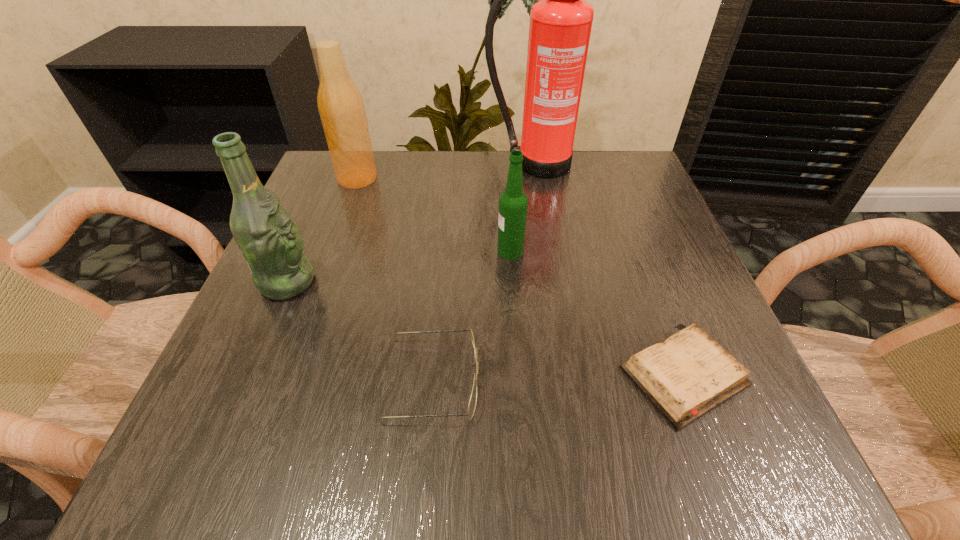
This screenshot has height=540, width=960. What are the coordinates of `vacant area situated on the surface of the nearest beer bottle` in the screenshot? It's located at (398, 282).

The height and width of the screenshot is (540, 960). I want to click on free location located 0.100m on the label of the rightmost beer bottle, so click(x=445, y=251).

Where is `free region located 0.080m on the label of the rightmost beer bottle`? The image size is (960, 540). free region located 0.080m on the label of the rightmost beer bottle is located at coordinates (456, 251).

The image size is (960, 540). I want to click on vacant space located 0.190m on the label of the rightmost beer bottle, so click(x=398, y=251).

You are a GUI agent. You are given a task and a screenshot of the screen. Output one action in this format:
    pyautogui.click(x=<x>, y=<y>)
    Task: Click on the vacant space located 0.250m on the front-facing side of the fifth tallest object
    The height and width of the screenshot is (540, 960).
    Given the screenshot: What is the action you would take?
    pyautogui.click(x=648, y=380)

Locate an element on the screen. This screenshot has width=960, height=540. vacant space located 0.270m on the back of the shortest object is located at coordinates (627, 226).

At what (x,y) coordinates should I click in order to perform the action: click on fire extinguisher located at the far edge. Please return your answer as a coordinate pair (x, y). Image resolution: width=960 pixels, height=540 pixels. Looking at the image, I should click on (560, 26).

Where is `beer bottle positioned at the far edge`? Image resolution: width=960 pixels, height=540 pixels. beer bottle positioned at the far edge is located at coordinates (341, 107).

Image resolution: width=960 pixels, height=540 pixels. Find the location of `spectacles located at the near edge`. spectacles located at the near edge is located at coordinates (473, 398).

I want to click on diary that is at the near edge, so [688, 374].